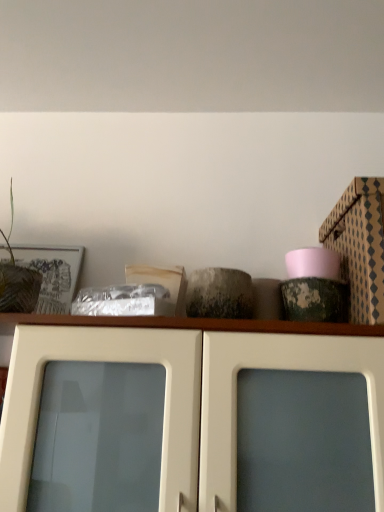
What do you see at coordinates (17, 281) in the screenshot? This screenshot has width=384, height=512. I see `green leafy plant at left` at bounding box center [17, 281].

Image resolution: width=384 pixels, height=512 pixels. Find the location of `patterned cardboard box at upper right`. patterned cardboard box at upper right is located at coordinates (360, 246).

Considering the sizes of objects patterned cardboard box at upper right and white glossy cabinet doors at center in the image provided, who is taller, patterned cardboard box at upper right or white glossy cabinet doors at center?

white glossy cabinet doors at center is taller.

From the image's perspective, is patterned cardboard box at upper right positioned above or below white glossy cabinet doors at center?

Clearly, from the image's perspective, patterned cardboard box at upper right is above white glossy cabinet doors at center.

Who is bigger, patterned cardboard box at upper right or white glossy cabinet doors at center?

Bigger between the two is white glossy cabinet doors at center.

Which object is closer to the camera, patterned cardboard box at upper right or white glossy cabinet doors at center?

Positioned in front is white glossy cabinet doors at center.

Would you say green leafy plant at left contains white glossy cabinet doors at center?

No, green leafy plant at left does not contain white glossy cabinet doors at center.

Can you confirm if green leafy plant at left is positioned to the right of white glossy cabinet doors at center?

In fact, green leafy plant at left is to the left of white glossy cabinet doors at center.

From the image's perspective, is green leafy plant at left below white glossy cabinet doors at center?

No.

Could you tell me if green leafy plant at left is facing white glossy cabinet doors at center?

No, green leafy plant at left is not facing towards white glossy cabinet doors at center.

Does white glossy cabinet doors at center appear on the left side of patterned cardboard box at upper right?

Yes.

Is point (248, 333) positioned before point (349, 253)?

Yes.

Measure the distance between white glossy cabinet doors at center and patterned cardboard box at upper right.

white glossy cabinet doors at center and patterned cardboard box at upper right are 14.16 inches apart.

Based on their sizes in the image, would you say white glossy cabinet doors at center is bigger or smaller than patterned cardboard box at upper right?

Clearly, white glossy cabinet doors at center is larger in size than patterned cardboard box at upper right.

Is point (13, 282) positioned after point (372, 207)?

Yes.

Considering the relative positions of green leafy plant at left and patterned cardboard box at upper right in the image provided, is green leafy plant at left in front of patterned cardboard box at upper right?

Yes, it is in front of patterned cardboard box at upper right.

Which object is positioned more to the left, green leafy plant at left or patterned cardboard box at upper right?

From the viewer's perspective, green leafy plant at left appears more on the left side.

Can you confirm if green leafy plant at left is smaller than patterned cardboard box at upper right?

Yes.

Who is shorter, patterned cardboard box at upper right or green leafy plant at left?

Standing shorter between the two is patterned cardboard box at upper right.

Is point (341, 255) closer or farther from the camera than point (31, 303)?

Clearly, point (341, 255) is more distant from the camera than point (31, 303).

From the picture: How different are the orientations of patterned cardboard box at upper right and green leafy plant at left in degrees?

0.0427 degrees separate the facing orientations of patterned cardboard box at upper right and green leafy plant at left.

Are white glossy cabinet doors at center and green leafy plant at left making contact?

No.

What's the angular difference between white glossy cabinet doors at center and green leafy plant at left's facing directions?

1.44 degrees separate the facing orientations of white glossy cabinet doors at center and green leafy plant at left.

Which object is positioned more to the right, white glossy cabinet doors at center or green leafy plant at left?

From the viewer's perspective, white glossy cabinet doors at center appears more on the right side.

Between white glossy cabinet doors at center and green leafy plant at left, which one has more height?

white glossy cabinet doors at center is taller.

The height and width of the screenshot is (512, 384). Identify the location of cabinetry below the patterned cardboard box at upper right (from the image's perspective). (191, 421).

The image size is (384, 512). I want to click on cabinetry in front of the green leafy plant at left, so click(x=191, y=421).

Based on their spatial positions, is white glossy cabinet doors at center or patterned cardboard box at upper right closer to green leafy plant at left?

white glossy cabinet doors at center is closer to green leafy plant at left.

Which object lies further to the anchor point white glossy cabinet doors at center, green leafy plant at left or patterned cardboard box at upper right?

Among the two, green leafy plant at left is located further to white glossy cabinet doors at center.

From the image, which object appears to be nearer to green leafy plant at left, patterned cardboard box at upper right or white glossy cabinet doors at center?

white glossy cabinet doors at center lies closer to green leafy plant at left than the other object.

Which object lies nearer to the anchor point patterned cardboard box at upper right, white glossy cabinet doors at center or green leafy plant at left?

The object closer to patterned cardboard box at upper right is white glossy cabinet doors at center.

When comparing their distances from patterned cardboard box at upper right, does green leafy plant at left or white glossy cabinet doors at center seem further?

green leafy plant at left is further to patterned cardboard box at upper right.

Which object lies further to the anchor point white glossy cabinet doors at center, patterned cardboard box at upper right or green leafy plant at left?

green leafy plant at left.

This screenshot has width=384, height=512. Identify the location of cabinetry between green leafy plant at left and patterned cardboard box at upper right in the horizontal direction. (191, 421).